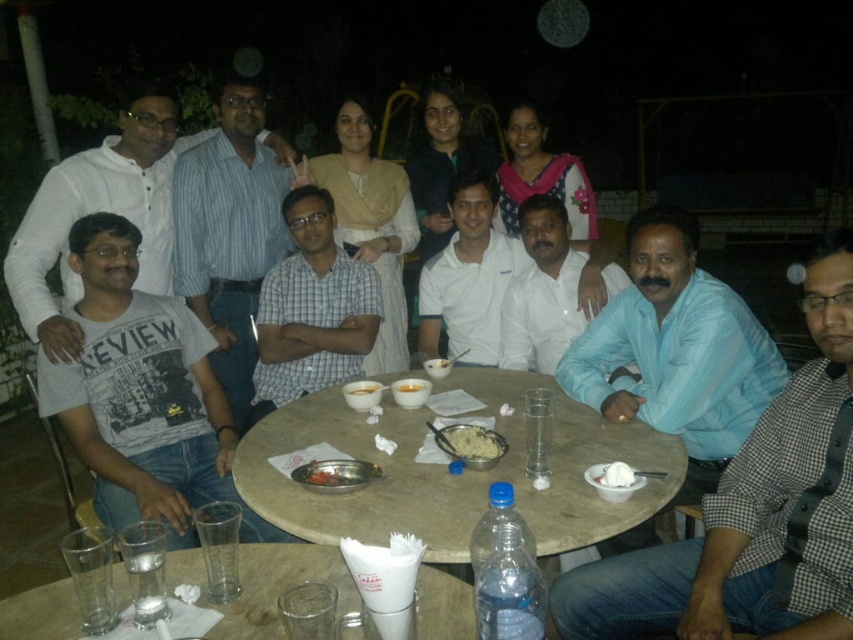
Question: Observing the image, what is the correct spatial positioning of white rice at center in reference to yellow matte bowl at center?

Choices:
 (A) right
 (B) left

Answer: (A)

Question: Can you confirm if marble table at center is positioned above white creamy ice cream at center?

Choices:
 (A) yes
 (B) no

Answer: (A)

Question: Is marble table at center smaller than smooth white rice bowl at center?

Choices:
 (A) no
 (B) yes

Answer: (A)

Question: Among these points, which one is farthest from the camera?

Choices:
 (A) (403, 387)
 (B) (370, 387)
 (C) (614, 468)
 (D) (445, 444)

Answer: (B)

Question: Considering the real-world distances, which object is closest to the white rice at center?

Choices:
 (A) smooth white rice bowl at center
 (B) white creamy ice cream at center
 (C) marble table at center
 (D) yellow matte bowl at center

Answer: (C)

Question: Which object is positioned closest to the yellow matte bowl at center?

Choices:
 (A) clear plastic cups at lower center
 (B) marble table at center

Answer: (B)